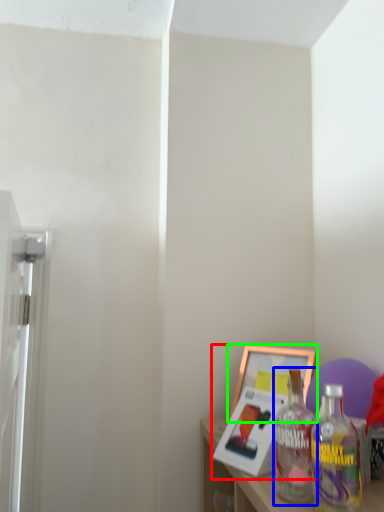
Question: Which object is positioned farthest from picture frame (highlighted by a red box)? Select from bottle (highlighted by a blue box) and picture frame (highlighted by a green box).

Choices:
 (A) bottle
 (B) picture frame

Answer: (A)